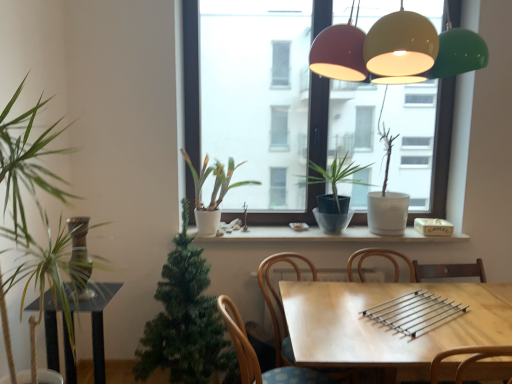
Question: Does matte glass lampshades at upper center have a lesser width compared to white matte pot at center, which is the fifth houseplant in left-to-right order?

Choices:
 (A) yes
 (B) no

Answer: (B)

Question: From a real-world perspective, is matte glass lampshades at upper center physically above white matte pot at center, which is the fifth houseplant in left-to-right order?

Choices:
 (A) no
 (B) yes

Answer: (B)

Question: Considering the relative positions of matte glass lampshades at upper center and white matte pot at center, which is the fifth houseplant in left-to-right order, in the image provided, is matte glass lampshades at upper center to the left of white matte pot at center, which is the fifth houseplant in left-to-right order, from the viewer's perspective?

Choices:
 (A) no
 (B) yes

Answer: (B)

Question: Are matte glass lampshades at upper center and white matte pot at center, which ranks as the 1th houseplant in right-to-left order, making contact?

Choices:
 (A) no
 (B) yes

Answer: (A)

Question: Does matte glass lampshades at upper center contain white matte pot at center, which is the fifth houseplant in left-to-right order?

Choices:
 (A) yes
 (B) no

Answer: (B)

Question: Can you confirm if matte glass lampshades at upper center is smaller than white matte pot at center, which is the fifth houseplant in left-to-right order?

Choices:
 (A) yes
 (B) no

Answer: (B)

Question: Considering the relative sizes of matte glass lampshades at upper center and green matte artificial tree at lower center, the 4th houseplant positioned from the right, in the image provided, is matte glass lampshades at upper center wider than green matte artificial tree at lower center, the 4th houseplant positioned from the right,?

Choices:
 (A) no
 (B) yes

Answer: (B)

Question: Can you confirm if matte glass lampshades at upper center is smaller than green matte artificial tree at lower center, the 4th houseplant positioned from the right?

Choices:
 (A) yes
 (B) no

Answer: (A)

Question: Would you say green matte artificial tree at lower center, which is counted as the second houseplant, starting from the left, is part of matte glass lampshades at upper center's contents?

Choices:
 (A) yes
 (B) no

Answer: (B)

Question: From a real-world perspective, is matte glass lampshades at upper center on green matte artificial tree at lower center, the 4th houseplant positioned from the right?

Choices:
 (A) no
 (B) yes

Answer: (B)

Question: Does matte glass lampshades at upper center come in front of green matte artificial tree at lower center, the 4th houseplant positioned from the right?

Choices:
 (A) no
 (B) yes

Answer: (B)

Question: Can you confirm if matte glass lampshades at upper center is thinner than green matte artificial tree at lower center, which is counted as the second houseplant, starting from the left?

Choices:
 (A) yes
 (B) no

Answer: (B)

Question: Is white matte plant at center, placed as the 3th houseplant when sorted from left to right, positioned with its back to matte glass lampshades at upper center?

Choices:
 (A) no
 (B) yes

Answer: (A)